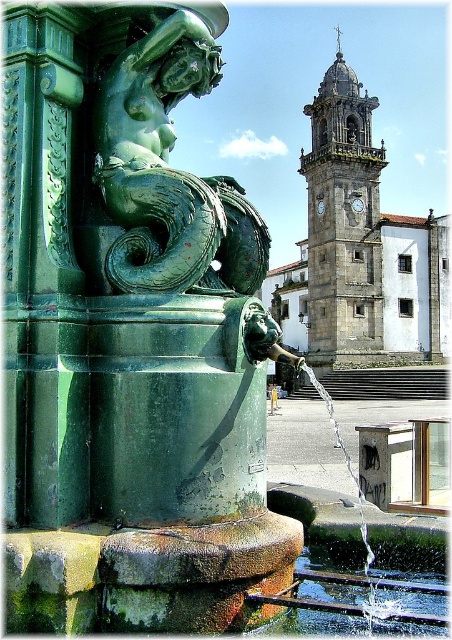
You are a city planner assessing the space around the fountain. The green patinated bronze mermaid at center and the gray stone clock tower at upper center are both part of the cityscape. If you need to install a new bench that must be placed between these two landmarks, which one would you position the bench closer to to ensure it doesn

Since the green patinated bronze mermaid at center occupies less space than the gray stone clock tower at upper center, the bench should be placed closer to the mermaid to maintain balance between the two structures.